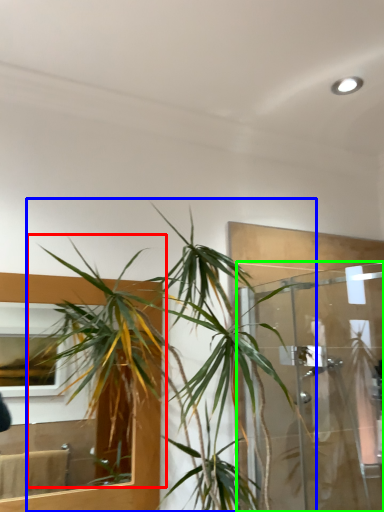
Question: Based on their relative distances, which object is farther from vegetation (highlighted by a red box)? Choose from houseplant (highlighted by a blue box) and glass door (highlighted by a green box).

Choices:
 (A) houseplant
 (B) glass door

Answer: (B)